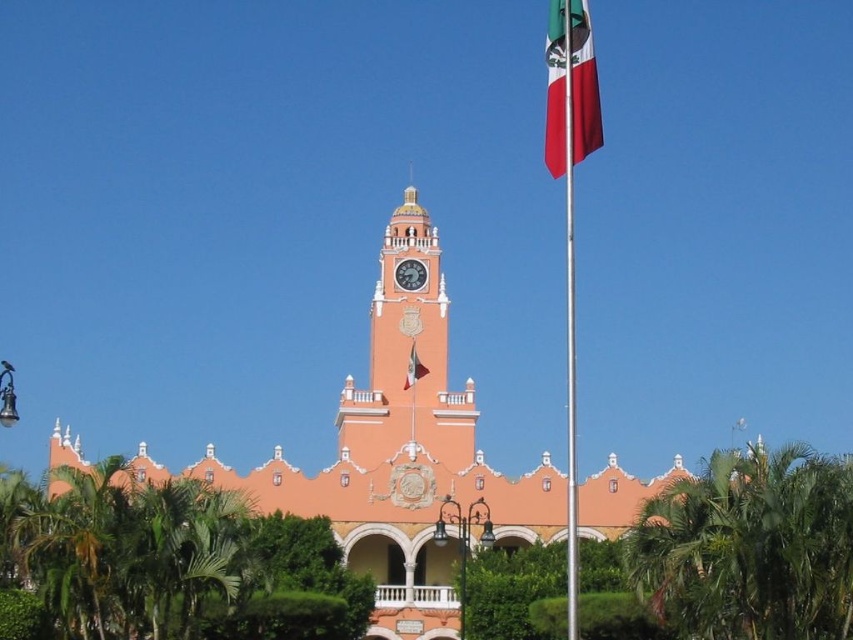
In the scene shown: Who is more distant from viewer, (746, 504) or (463, 424)?

Point (463, 424)

Is green leafy palm tree at lower right above pink stucco clock tower at center?

Actually, green leafy palm tree at lower right is below pink stucco clock tower at center.

Is point (769, 490) farther from viewer compared to point (445, 358)?

No, it is not.

Locate an element on the screen. The width and height of the screenshot is (853, 640). green leafy palm tree at lower right is located at coordinates (749, 547).

Is point (544, 472) behind point (416, 376)?

No.

Can you confirm if orange stucco church at center is bigger than silky fabric flag at center?

Yes, orange stucco church at center is bigger than silky fabric flag at center.

Measure the distance between orange stucco church at center and camera.

orange stucco church at center is 69.36 meters from camera.

What are the coordinates of `orange stucco church at center` in the screenshot? It's located at (399, 456).

Between green leafy palm tree at lower right and silver metallic flag pole at right, which one appears on the left side from the viewer's perspective?

Positioned to the left is silver metallic flag pole at right.

Measure the distance between green leafy palm tree at lower right and camera.

They are 68.37 meters apart.

Does point (828, 627) lie in front of point (579, 52)?

No, it is not.

Locate an element on the screen. green leafy palm tree at lower right is located at coordinates (749, 547).